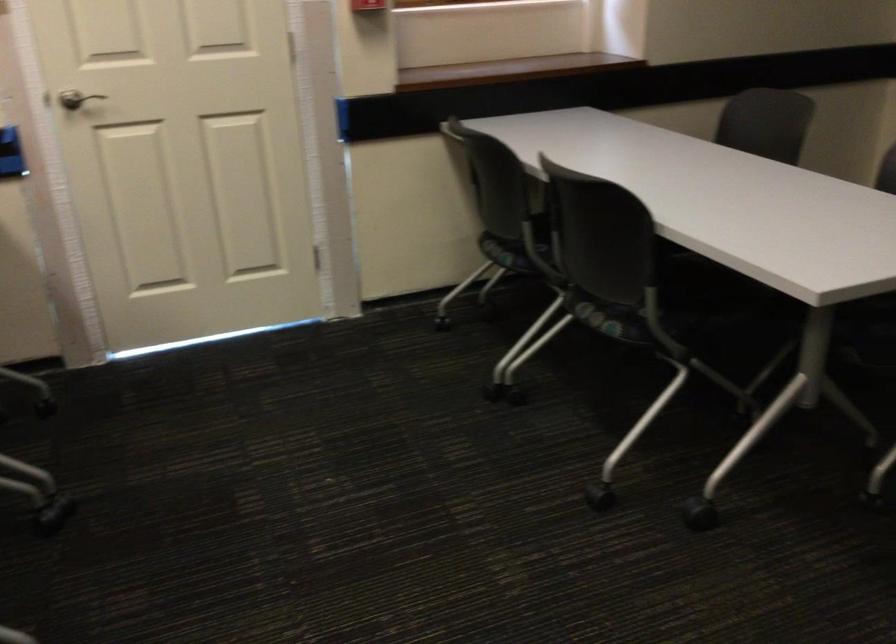
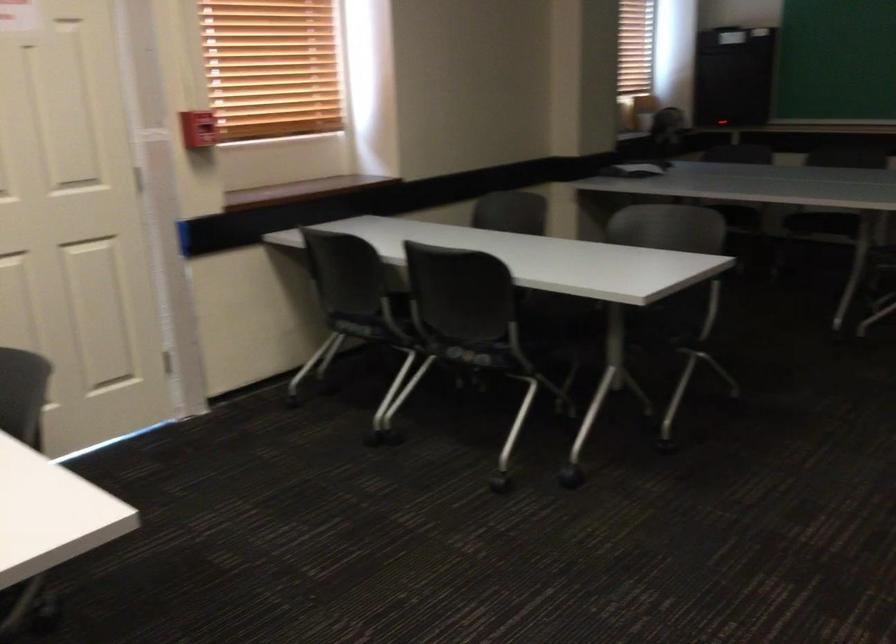
The point at (512, 254) is marked in the first image. Where is the corresponding point in the second image?

(360, 328)